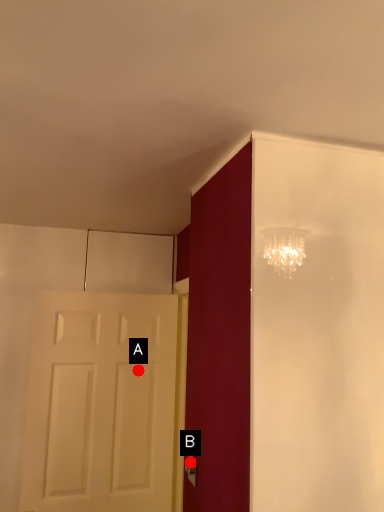
Question: Two points are circled on the image, labeled by A and B beside each circle. Which point is farther from the camera taking this photo?

Choices:
 (A) A is further
 (B) B is further

Answer: (A)